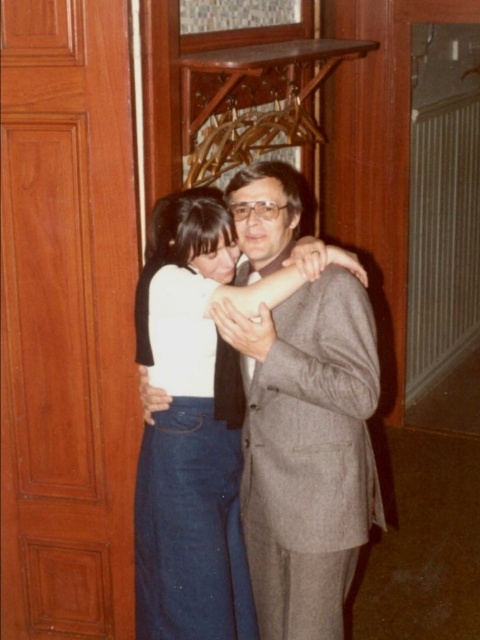
Can you confirm if matte gray suit at center is positioned to the right of white matte dress at center?

Yes, matte gray suit at center is to the right of white matte dress at center.

How much distance is there between matte gray suit at center and white matte dress at center?

matte gray suit at center is 8.59 inches away from white matte dress at center.

Which is behind, point (240, 205) or point (194, 442)?

The point (194, 442) is behind.

The image size is (480, 640). What are the coordinates of `matte gray suit at center` in the screenshot? It's located at (307, 451).